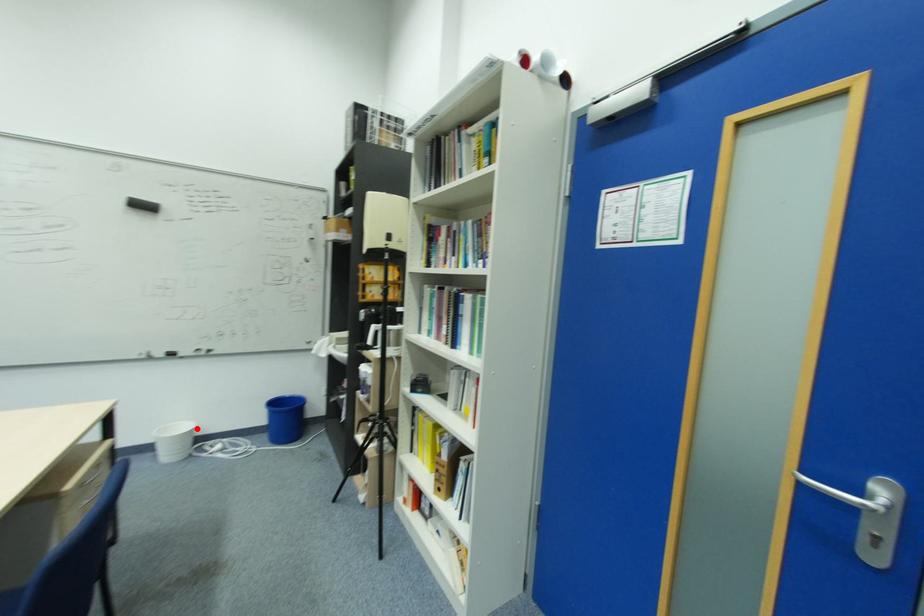
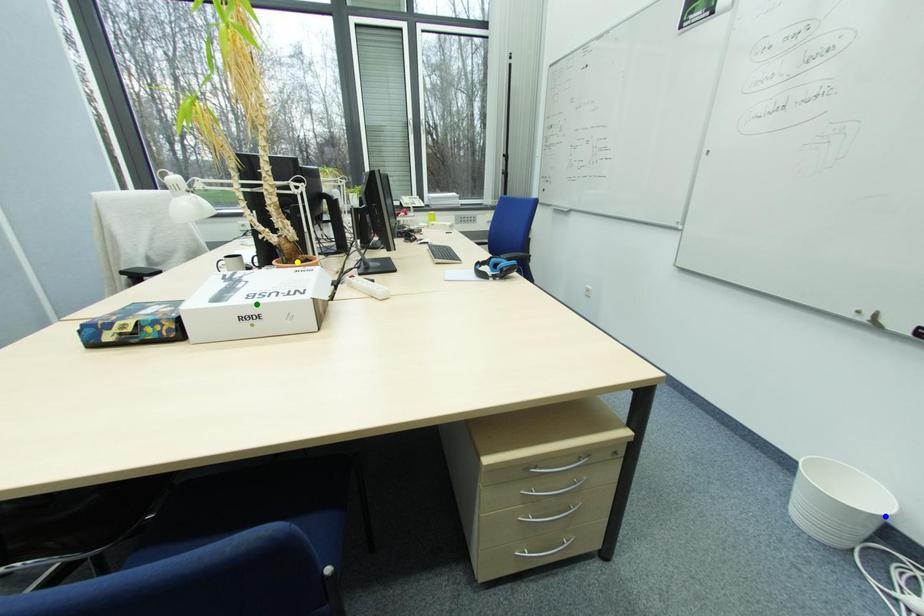
Question: I am providing you with two images of the same scene from different viewpoints. A red point is marked on the first image. You are given multiple points on the second image. Which mark in image 2 goes with the point in image 1?

Choices:
 (A) yellow point
 (B) green point
 (C) blue point

Answer: (C)